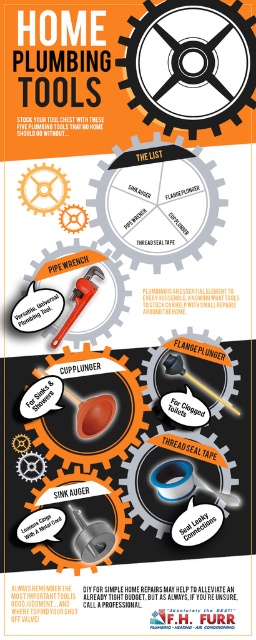
You are organizing a tool chest and need to place the brushed metal sink auger at lower center and the matte black flange plunger at center. If the tool chest has a compartment that is only wide enough for one tool, which tool should you place there based on their widths?

The brushed metal sink auger at lower center might be wider than the matte black flange plunger at center, so you should place the brushed metal sink auger at lower center in the wider compartment to ensure it fits properly.

You are a plumber standing 1 meter away from the orange rubber cup plunger at center displayed in the image. Can you reach it without moving closer?

The orange rubber cup plunger at center is 89.34 centimeters away from the viewer. Since you are standing 1 meter away, which is farther than the distance specified, you cannot reach it without moving closer.

You are a plumber trying to organize your tools on a shelf. The shelf has a width of 20 inches. You have a brushed metal sink auger at lower center and an orange rubber cup plunger at center. Can both tools fit side by side on the shelf without overlapping?

The brushed metal sink auger at lower center is 20.17 inches away from the orange rubber cup plunger at center, which means there is insufficient space between them to fit on a 20 inch shelf without overlapping. Therefore, they cannot both fit side by side on the shelf.